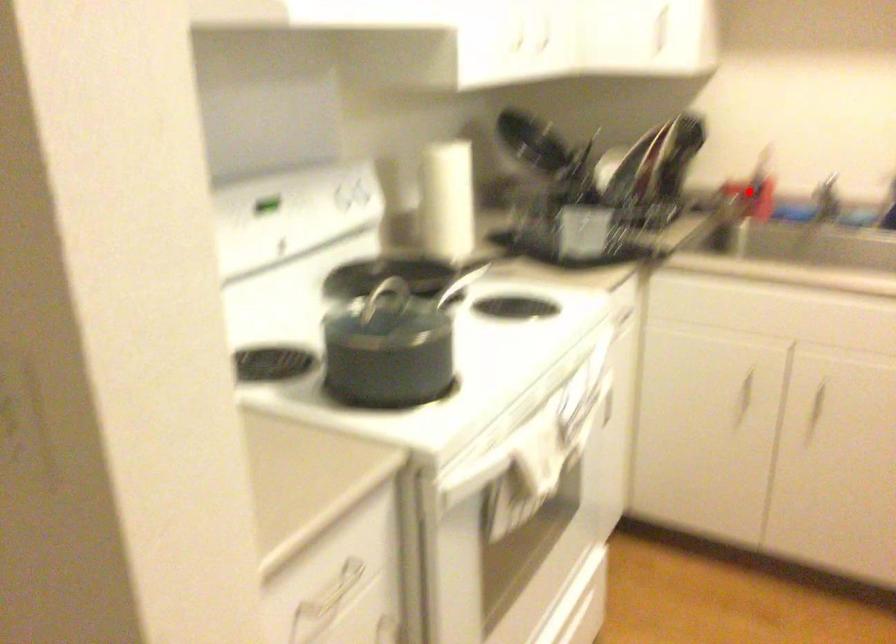
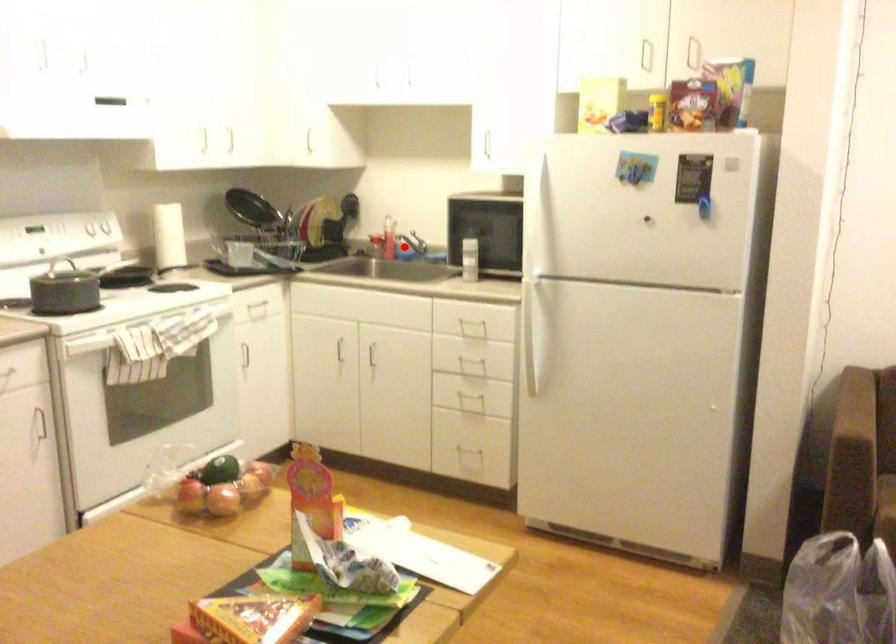
I am providing you with two images of the same scene from different viewpoints. A red point is marked on the first image and another point is marked on the second image. Is the marked point in image1 the same physical position as the marked point in image2?

Yes